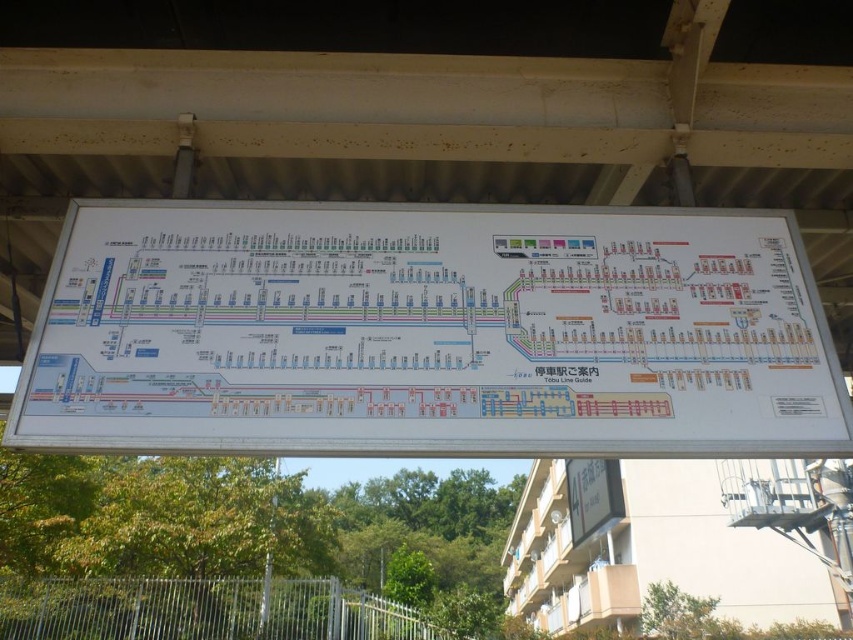
Which is more to the left, white paper map at center or white paper signboard at center?

white paper map at center is more to the left.

Is point (469, 256) positioned before point (763, 42)?

Yes.

Where is `white paper map at center`? white paper map at center is located at coordinates (428, 332).